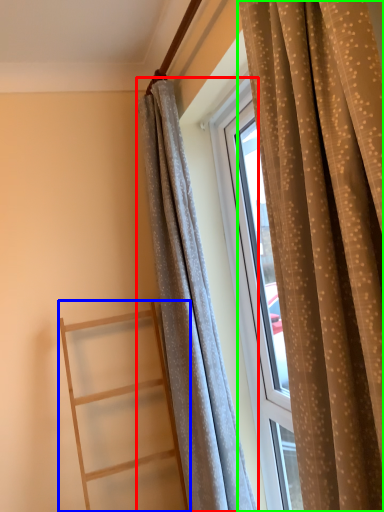
Question: Which object is positioned closest to curtain (highlighted by a red box)? Select from ladder (highlighted by a blue box) and curtain (highlighted by a green box).

Choices:
 (A) ladder
 (B) curtain

Answer: (A)